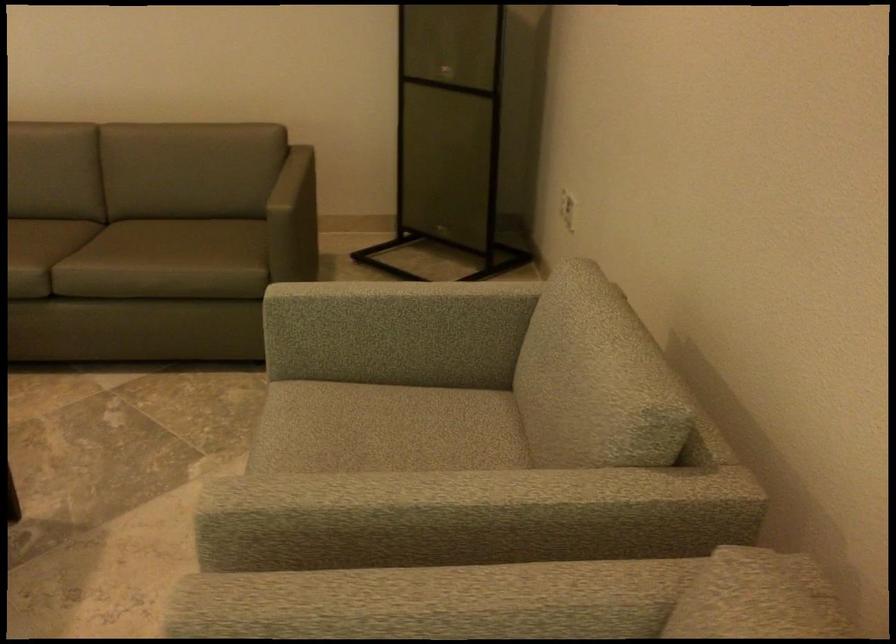
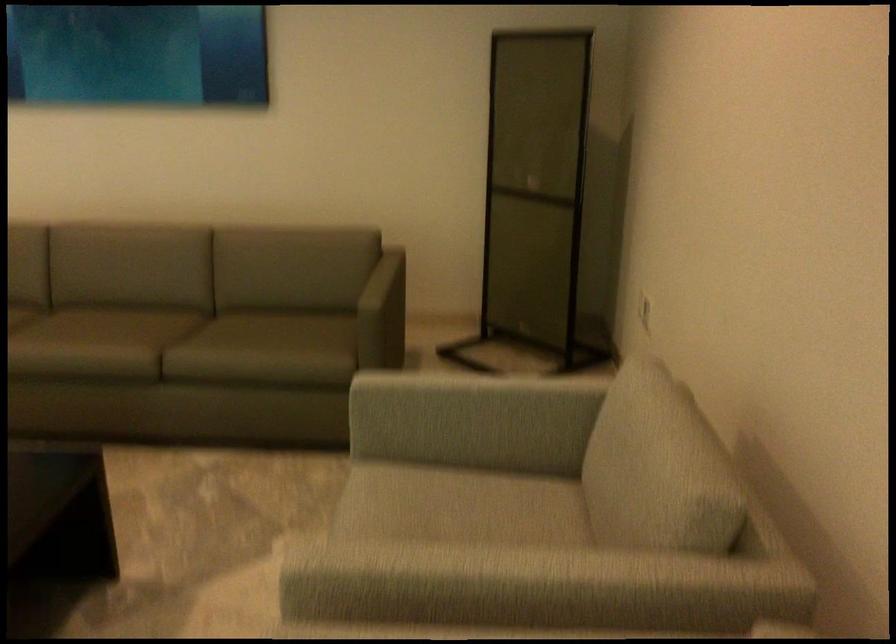
Find the pixel in the second image that matches point (455, 88) in the first image.

(536, 194)